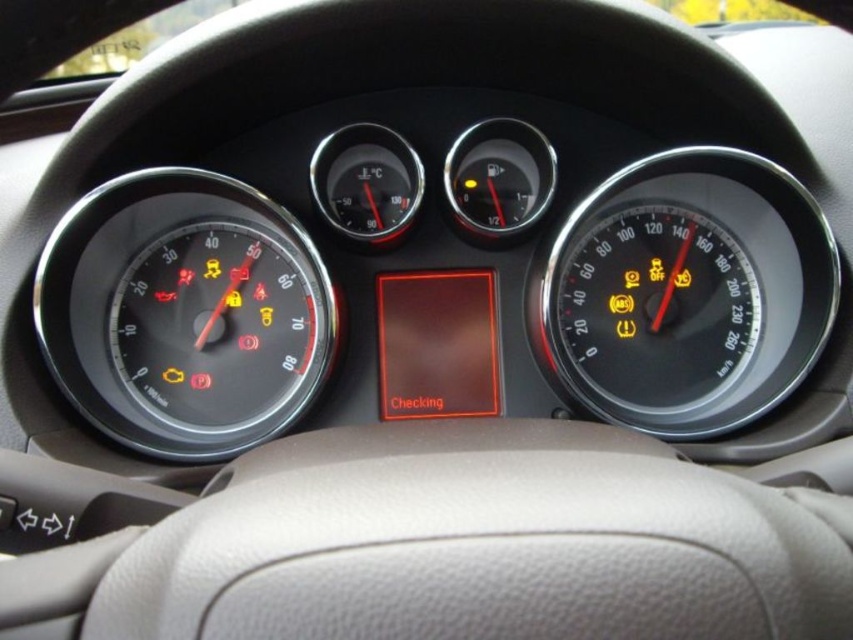
Between point (282, 253) and point (703, 243), which one is positioned behind?

The point (703, 243) is behind.

Which is below, black glossy speedometer at left or black glossy speedometer at right?

black glossy speedometer at left is lower down.

Describe the element at coordinates (184, 314) in the screenshot. The image size is (853, 640). I see `black glossy speedometer at left` at that location.

Where is `black glossy speedometer at left`? The image size is (853, 640). black glossy speedometer at left is located at coordinates (184, 314).